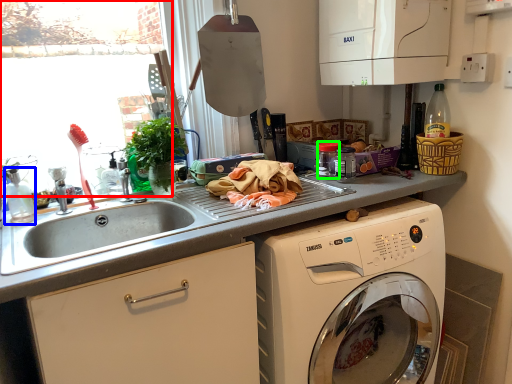
Question: Based on their relative distances, which object is farther from window screen (highlighted by a red box)? Choose from bottle (highlighted by a blue box) and appliance (highlighted by a green box).

Choices:
 (A) bottle
 (B) appliance

Answer: (B)